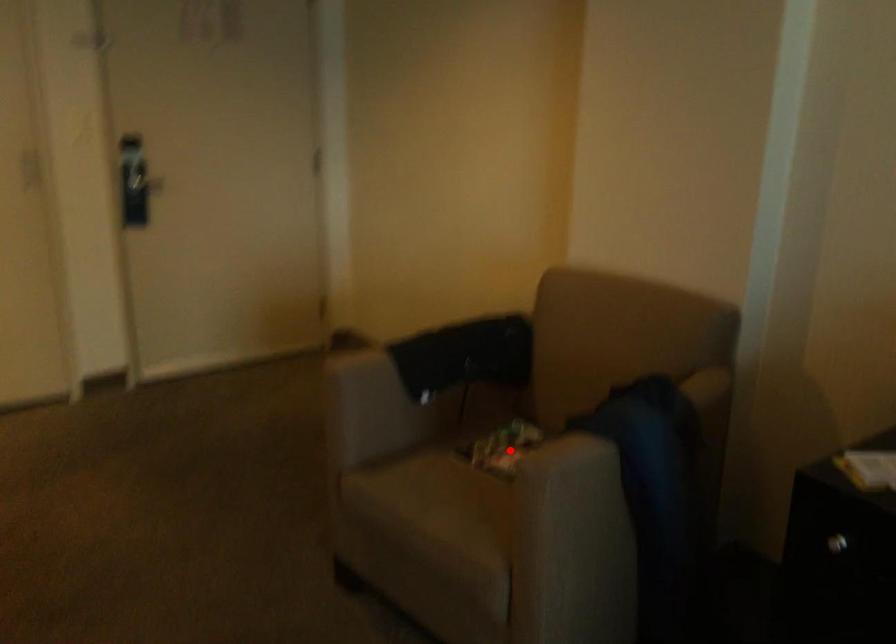
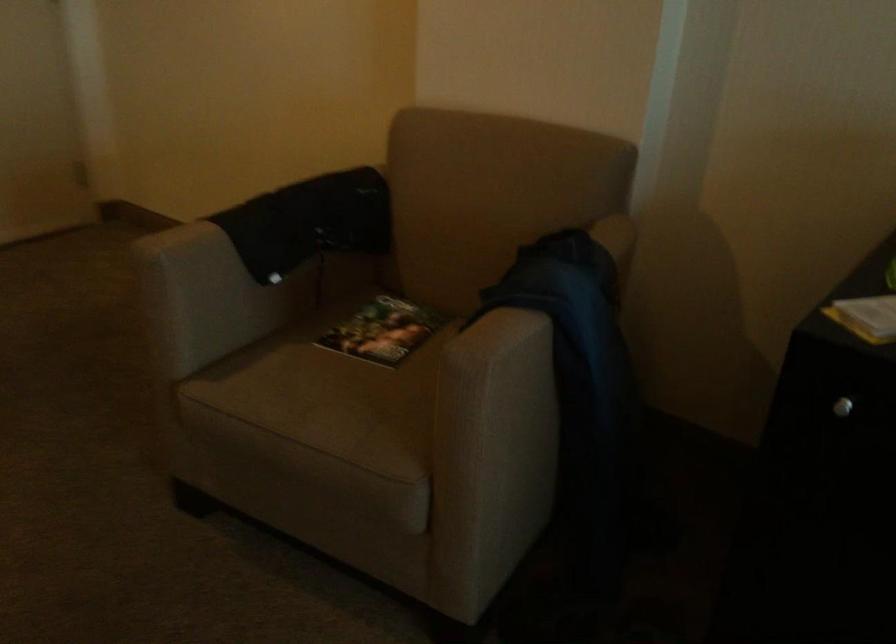
Locate, in the second image, the point that corresponds to the highlighted location in the first image.

(382, 330)